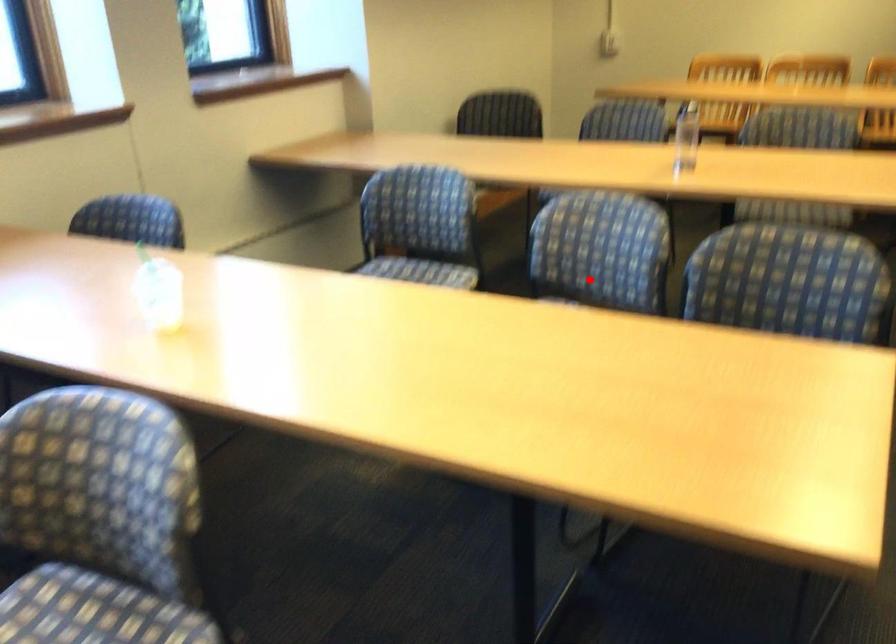
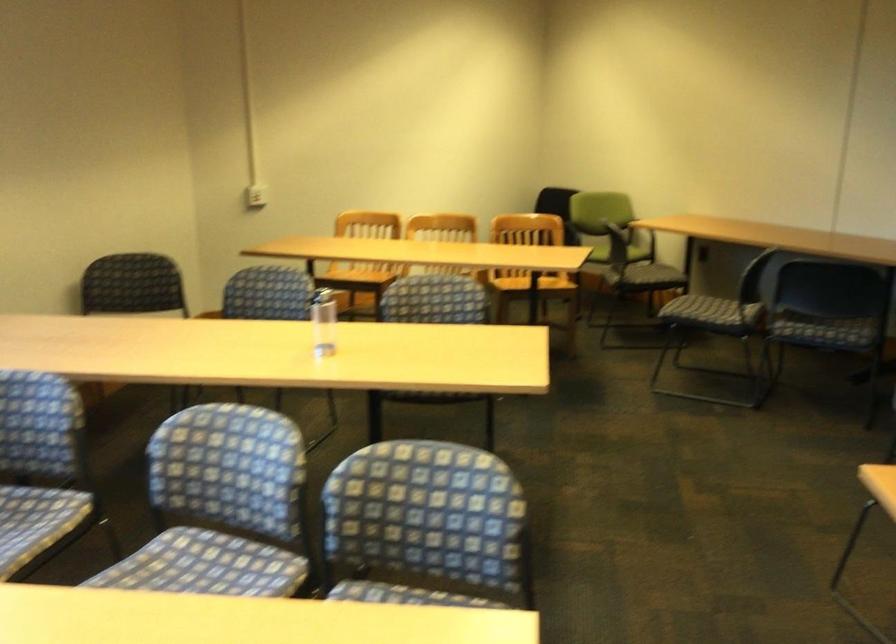
Question: I am providing you with two images of the same scene from different viewpoints. A red point is marked on the first image. At the location where the point appears in image 1, is it still visible in image 2?

Choices:
 (A) Yes
 (B) No

Answer: (A)